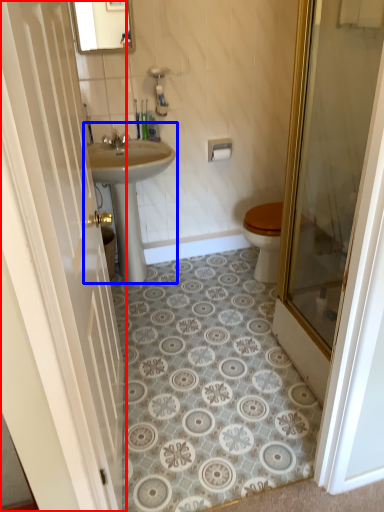
Question: Among these objects, which one is nearest to the camera, door (highlighted by a red box) or sink (highlighted by a blue box)?

Choices:
 (A) door
 (B) sink

Answer: (A)